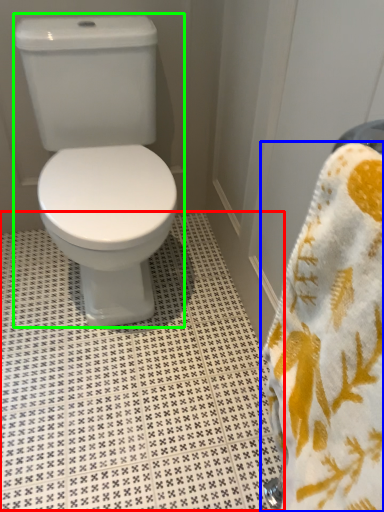
Question: Based on their relative distances, which object is nearer to tile (highlighted by a red box)? Choose from towel (highlighted by a blue box) and toilet (highlighted by a green box).

Choices:
 (A) towel
 (B) toilet

Answer: (B)